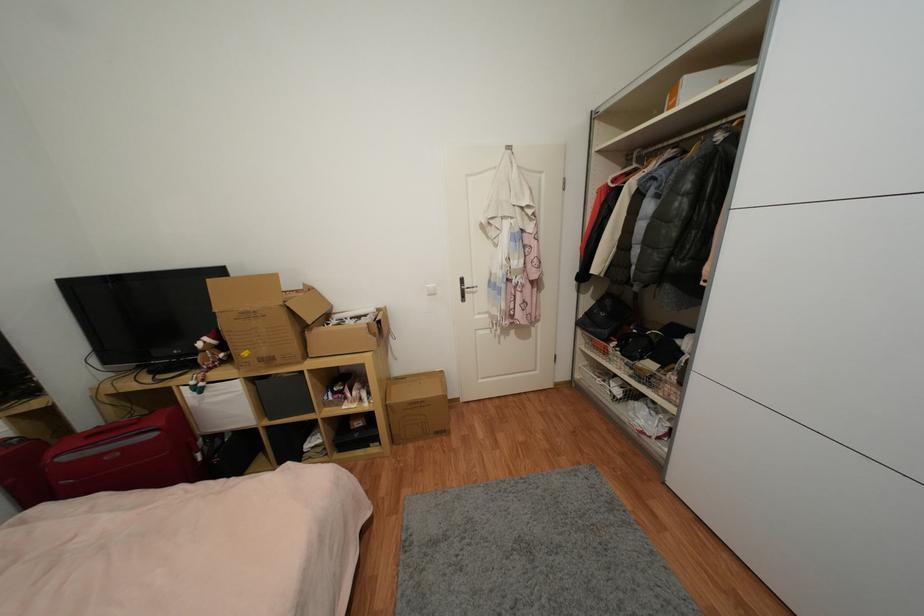
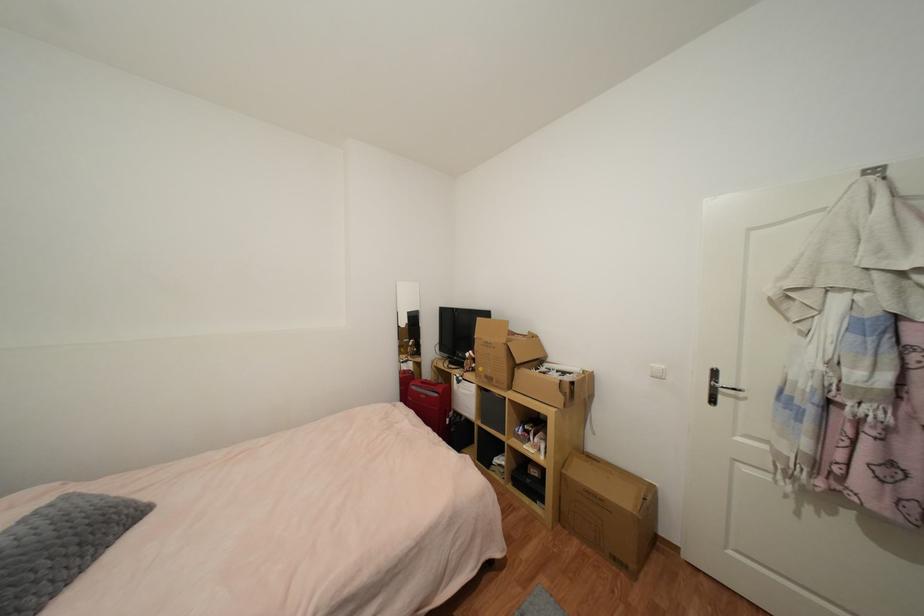
The point at (157, 436) is marked in the first image. Where is the corresponding point in the second image?

(440, 397)